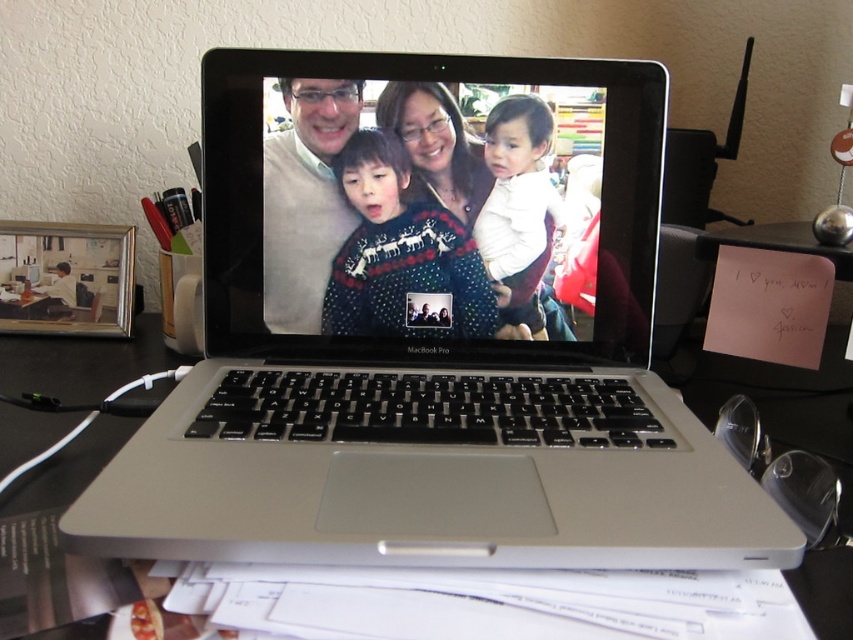
Question: Does black plastic table at center have a greater width compared to white soft fabric at center?

Choices:
 (A) no
 (B) yes

Answer: (B)

Question: Which of the following is the farthest from the observer?

Choices:
 (A) (601, 403)
 (B) (515, 301)
 (C) (329, 314)

Answer: (C)

Question: Can you confirm if silver metallic laptop at center is smaller than matte black laptop at center?

Choices:
 (A) no
 (B) yes

Answer: (A)

Question: Estimate the real-world distances between objects in this image. Which object is farther from the white soft fabric at center?

Choices:
 (A) matte black laptop at center
 (B) silver metallic laptop at center

Answer: (B)

Question: Which of the following is the farthest from the observer?

Choices:
 (A) (345, 216)
 (B) (68, 376)
 (C) (289, 227)
 (D) (409, 166)

Answer: (B)

Question: Is matte black laptop at center bigger than matte white sweater at center?

Choices:
 (A) no
 (B) yes

Answer: (B)